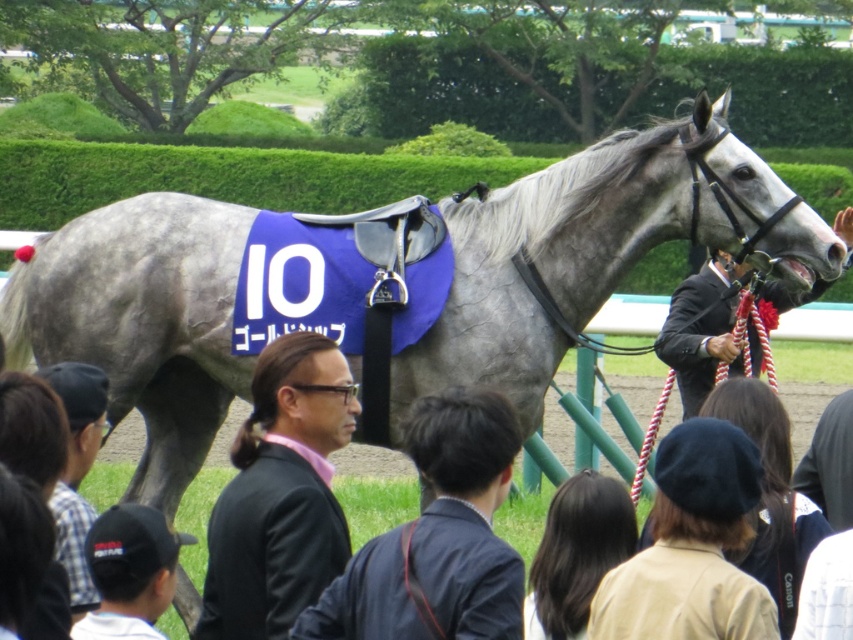
Which of these two, black matte suit at center or plaid shirt at lower left, stands taller?

black matte suit at center is taller.

Based on the photo, can you confirm if black matte suit at center is positioned above plaid shirt at lower left?

No, black matte suit at center is not above plaid shirt at lower left.

In order to click on black matte suit at center in this screenshot , I will do `click(280, 493)`.

This screenshot has height=640, width=853. Find the location of `black matte suit at center`. black matte suit at center is located at coordinates (280, 493).

Based on the photo, is dark gray suit at center further to camera compared to black suit at center?

No, it is not.

Is point (473, 568) positioned after point (669, 330)?

That is False.

You are a GUI agent. You are given a task and a screenshot of the screen. Output one action in this format:
    pyautogui.click(x=<x>, y=<y>)
    Task: Click on the dark gray suit at center
    The width and height of the screenshot is (853, 640).
    Given the screenshot: What is the action you would take?
    pyautogui.click(x=437, y=538)

Does black fabric cap at lower left have a lesser height compared to plaid shirt at lower left?

Correct, black fabric cap at lower left is not as tall as plaid shirt at lower left.

Is black fabric cap at lower left thinner than plaid shirt at lower left?

Yes.

This screenshot has height=640, width=853. Identify the location of black fabric cap at lower left. (129, 572).

Where is `black fabric cap at lower left`? Image resolution: width=853 pixels, height=640 pixels. black fabric cap at lower left is located at coordinates (x=129, y=572).